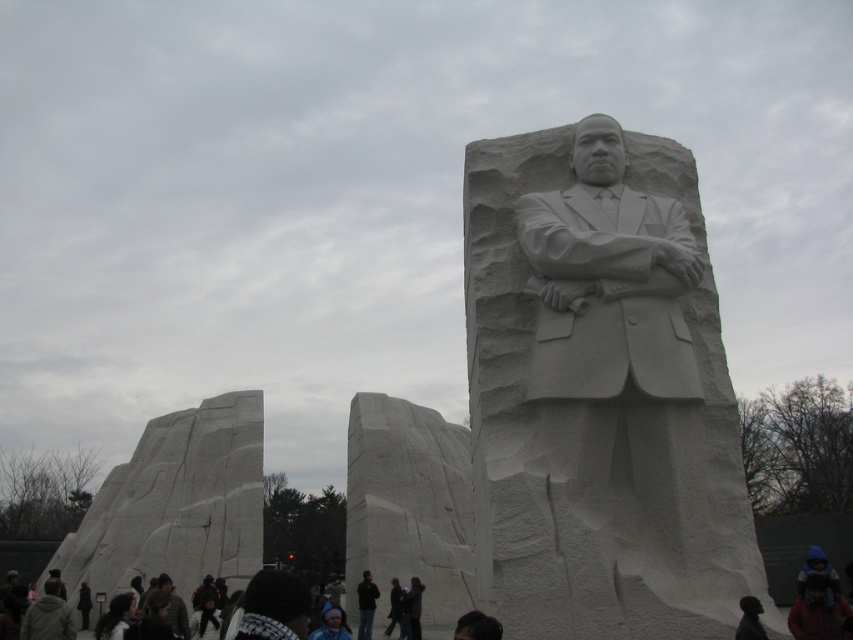
Question: Does black matte jacket at center appear on the left side of dark clothing at lower center?

Choices:
 (A) no
 (B) yes

Answer: (A)

Question: Can you confirm if white marble statue at center is positioned to the left of white marble stone at left?

Choices:
 (A) yes
 (B) no

Answer: (B)

Question: Which object is positioned farthest from the white marble statue at center?

Choices:
 (A) black matte jacket at center
 (B) white marble stone at left

Answer: (B)

Question: Which of the following is the closest to the observer?

Choices:
 (A) white marble stone at left
 (B) white marble statue at center
 (C) black matte jacket at center
 (D) dark clothing at lower center

Answer: (B)

Question: Can you confirm if white marble statue at center is bigger than black matte jacket at center?

Choices:
 (A) no
 (B) yes

Answer: (B)

Question: Which object is closer to the camera taking this photo?

Choices:
 (A) black matte jacket at center
 (B) white marble stone at left
 (C) dark clothing at lower center

Answer: (A)